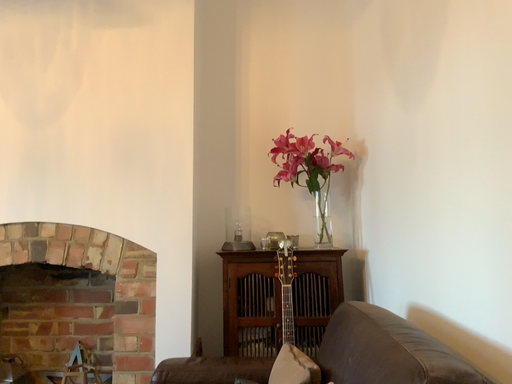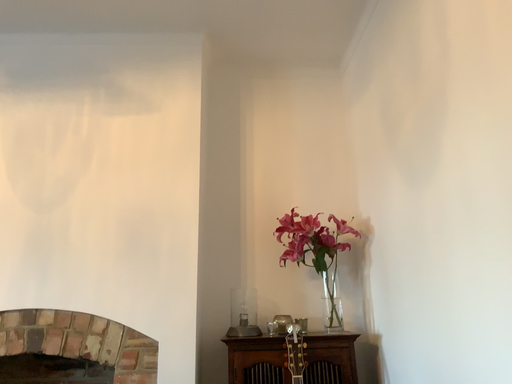
Question: How did the camera likely rotate when shooting the video?

Choices:
 (A) rotated downward
 (B) rotated upward

Answer: (B)